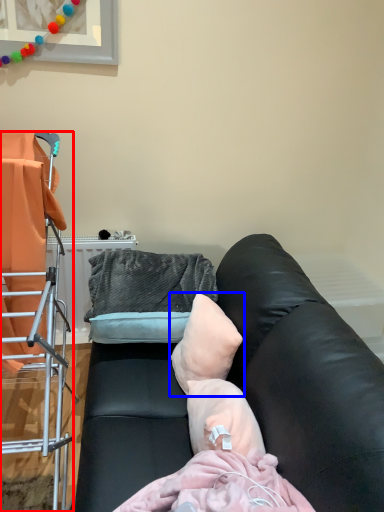
Question: Among these objects, which one is nearest to the camera, furniture (highlighted by a red box) or pillow (highlighted by a blue box)?

Choices:
 (A) furniture
 (B) pillow

Answer: (A)